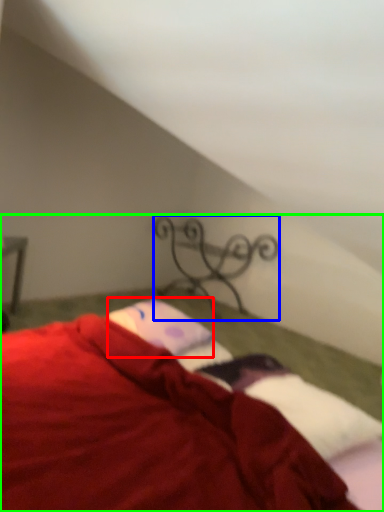
Question: Estimate the real-world distances between objects in this image. Which object is closer to pillow (highlighted by a red box), design (highlighted by a blue box) or bed (highlighted by a green box)?

Choices:
 (A) design
 (B) bed

Answer: (B)